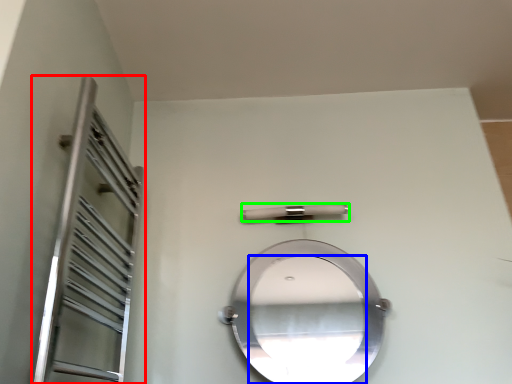
Question: Considering the real-world distances, which object is closest to screen door (highlighted by a red box)? mirror (highlighted by a blue box) or door handle (highlighted by a green box).

Choices:
 (A) mirror
 (B) door handle

Answer: (B)